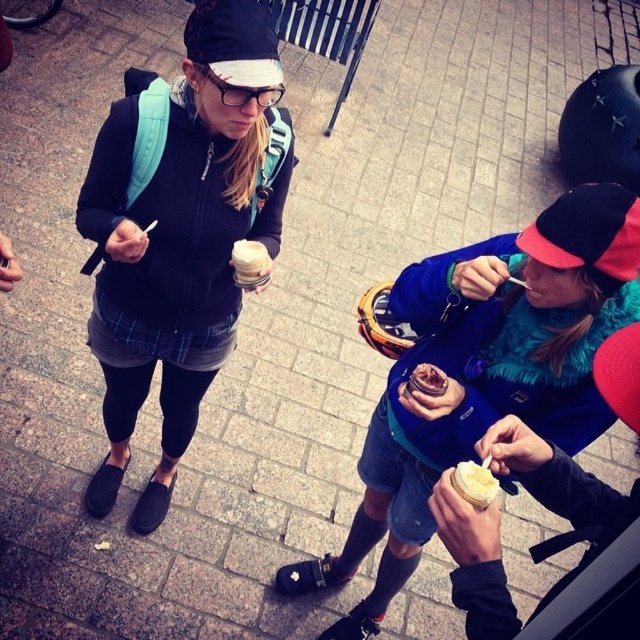
Question: Can you confirm if fuzzy blue jacket at center is wider than white matte ice cream cone at center?

Choices:
 (A) yes
 (B) no

Answer: (A)

Question: Which of these objects is positioned closest to the matte black jacket at center?

Choices:
 (A) white matte ice cream cone at center
 (B) fuzzy blue jacket at center
 (C) white creamy ice cream at lower right

Answer: (A)

Question: Considering the relative positions of matte black jacket at center and white matte ice cream cone at center in the image provided, where is matte black jacket at center located with respect to white matte ice cream cone at center?

Choices:
 (A) right
 (B) left

Answer: (B)

Question: Is white creamy ice cream at lower right closer to the viewer compared to white matte ice cream cone at center?

Choices:
 (A) no
 (B) yes

Answer: (B)

Question: Which object appears closest to the camera in this image?

Choices:
 (A) fuzzy blue jacket at center
 (B) white creamy ice cream at lower right
 (C) white matte ice cream cone at center

Answer: (B)

Question: Estimate the real-world distances between objects in this image. Which object is farther from the white matte ice cream cone at center?

Choices:
 (A) matte black jacket at center
 (B) white creamy ice cream at lower right
 (C) fuzzy blue jacket at center

Answer: (B)